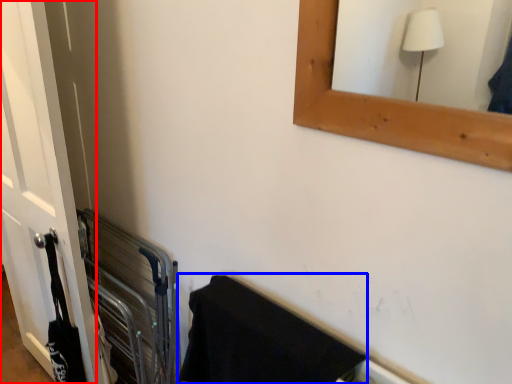
Question: Which object is further to the camera taking this photo, door (highlighted by a red box) or bath towel (highlighted by a blue box)?

Choices:
 (A) door
 (B) bath towel

Answer: (A)